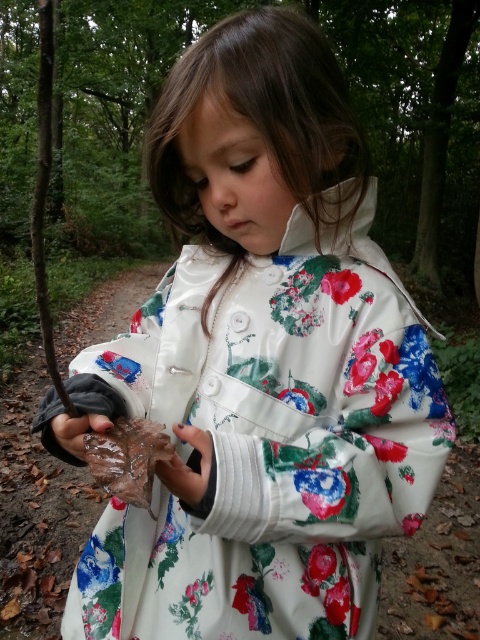
Is brown rough twig at left positioned at the back of transparent plastic leaf at lower left?

No, brown rough twig at left is in front of transparent plastic leaf at lower left.

Where is `brown rough twig at left`? This screenshot has height=640, width=480. brown rough twig at left is located at coordinates (45, 195).

Does matte brown glove at center have a lesser width compared to transparent plastic leaf at lower left?

Yes, matte brown glove at center is thinner than transparent plastic leaf at lower left.

Is point (211, 452) positioned before point (58, 419)?

Yes, it is.

The image size is (480, 640). I want to click on matte brown glove at center, so click(x=188, y=467).

Which is in front, point (49, 42) or point (183, 492)?

Point (49, 42) is in front.

Does brown rough twig at left have a greater height compared to matte brown glove at center?

Indeed, brown rough twig at left has a greater height compared to matte brown glove at center.

Who is more forward, (x=50, y=19) or (x=192, y=502)?

Point (x=50, y=19)

Identify the location of brown rough twig at left. This screenshot has width=480, height=640. (45, 195).